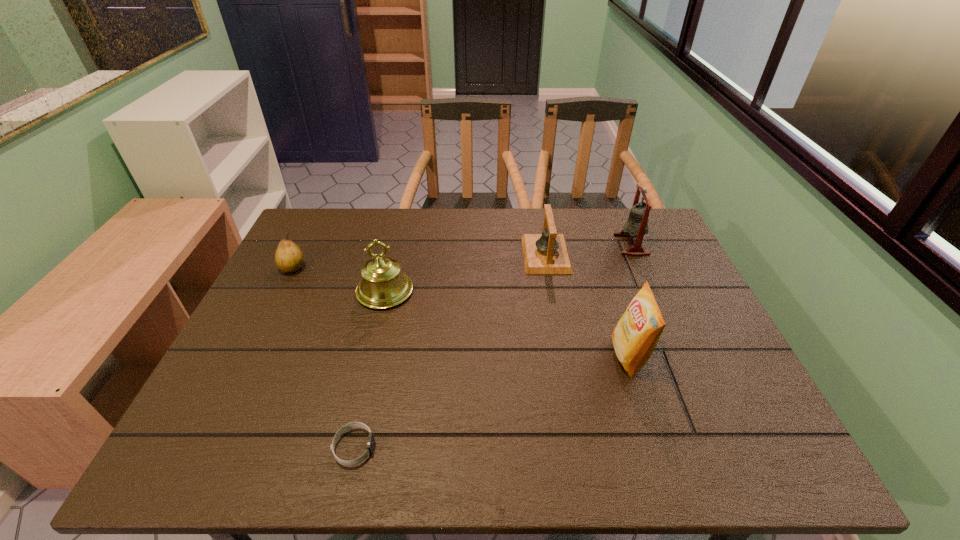
Identify the location of the rightmost object. The width and height of the screenshot is (960, 540). (637, 223).

You are a GUI agent. You are given a task and a screenshot of the screen. Output one action in this format:
    pyautogui.click(x=<x>, y=<y>)
    Task: Click on the second object from right to left
    The width and height of the screenshot is (960, 540).
    Given the screenshot: What is the action you would take?
    pyautogui.click(x=635, y=336)

Where is `the second nearest object`? The width and height of the screenshot is (960, 540). the second nearest object is located at coordinates (635, 336).

What are the coordinates of `the leftmost bell` in the screenshot? It's located at (383, 285).

What are the coordinates of `the third object from right to left` in the screenshot? It's located at (546, 253).

Identify the location of the shortest bell. This screenshot has width=960, height=540. (546, 253).

At what (x,y) coordinates should I click in order to perform the action: click on the leftmost object. Please return your answer as a coordinate pair (x, y). Looking at the image, I should click on (289, 258).

The width and height of the screenshot is (960, 540). I want to click on pear, so 289,258.

The height and width of the screenshot is (540, 960). I want to click on wristband, so pos(370,444).

Locate an element on the screen. the shortest object is located at coordinates (370, 444).